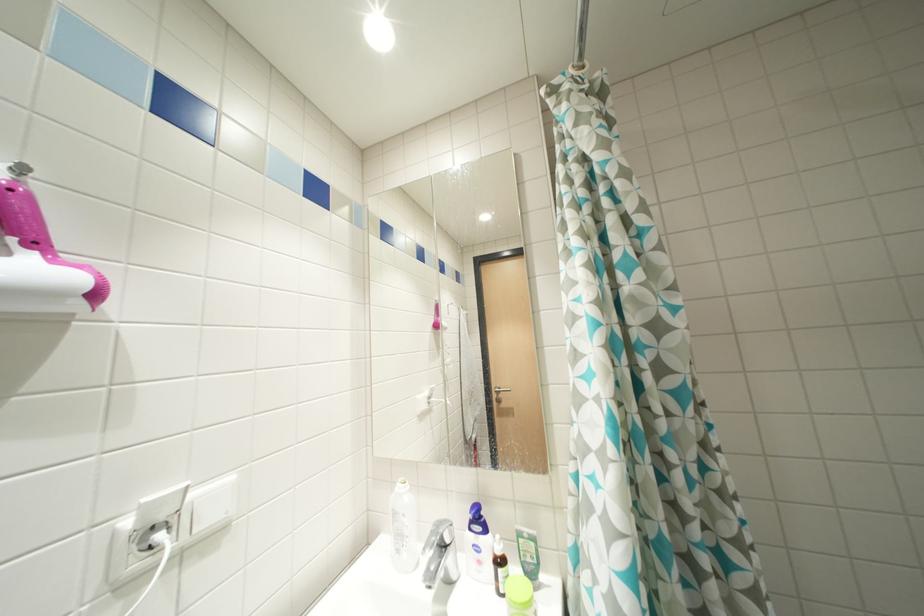
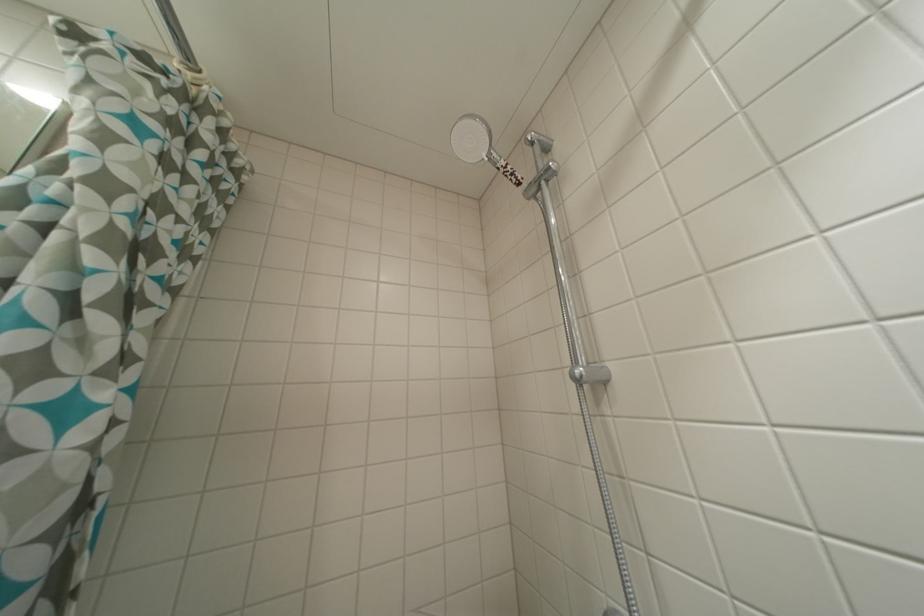
Consider the image. How did the camera likely rotate?

The camera's rotation is toward right-up.